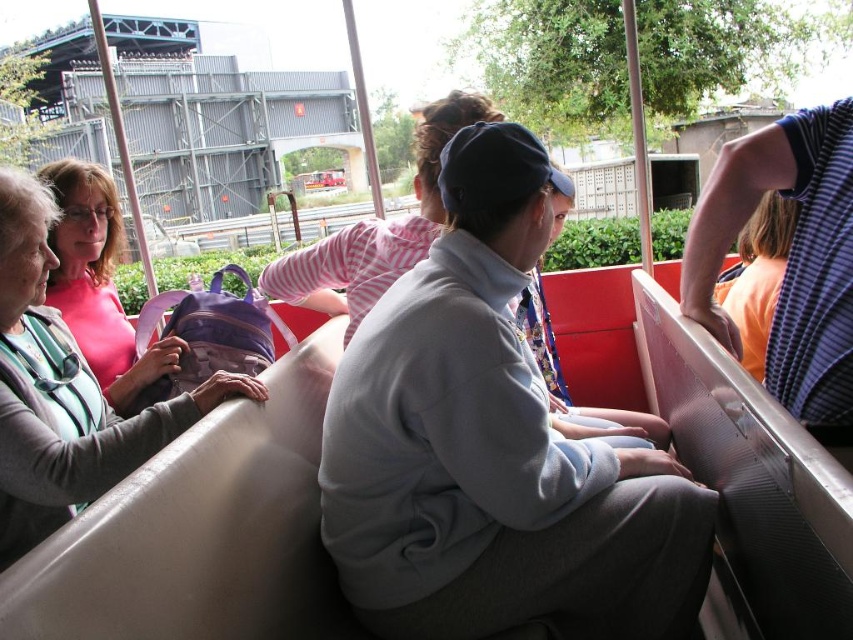
Is matte pink shirt at left wider than striped cotton shirt at right?

Yes, matte pink shirt at left is wider than striped cotton shirt at right.

Can you confirm if matte pink shirt at left is positioned above striped cotton shirt at right?

No.

Is point (38, 422) closer to viewer compared to point (827, 340)?

That is False.

Where is `matte pink shirt at left`? Image resolution: width=853 pixels, height=640 pixels. matte pink shirt at left is located at coordinates (62, 392).

Can you confirm if light gray fleece jacket at center is taller than matte pink shirt at left?

Indeed, light gray fleece jacket at center has a greater height compared to matte pink shirt at left.

Is light gray fleece jacket at center shorter than matte pink shirt at left?

No, light gray fleece jacket at center is not shorter than matte pink shirt at left.

Who is more distant from viewer, (567, 449) or (3, 333)?

The point (3, 333) is behind.

Find the location of a particular element. Image resolution: width=853 pixels, height=640 pixels. light gray fleece jacket at center is located at coordinates (492, 448).

Is light gray fleece jacket at center smaller than striped cotton shirt at right?

Incorrect, light gray fleece jacket at center is not smaller in size than striped cotton shirt at right.

Between light gray fleece jacket at center and striped cotton shirt at right, which one appears on the left side from the viewer's perspective?

light gray fleece jacket at center

Measure the distance between point (549, 433) and camera.

The distance of point (549, 433) from camera is 1.54 meters.

This screenshot has height=640, width=853. Find the location of `light gray fleece jacket at center`. light gray fleece jacket at center is located at coordinates point(492,448).